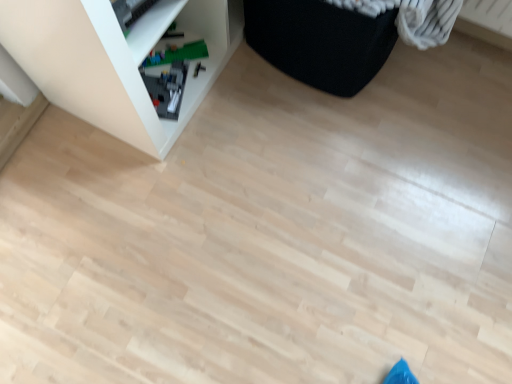
Describe the element at coordinates (177, 54) in the screenshot. I see `green plastic toy at lower left` at that location.

This screenshot has height=384, width=512. What are the coordinates of `white plastic shelf at upper left` in the screenshot? It's located at coord(117,60).

Where is `green plastic toy at lower left`? This screenshot has width=512, height=384. green plastic toy at lower left is located at coordinates pos(177,54).

The width and height of the screenshot is (512, 384). What are the coordinates of `shelf in front of the green plastic toy at lower left` in the screenshot? It's located at (117, 60).

What's the angular difference between green plastic toy at lower left and white plastic shelf at upper left's facing directions?

green plastic toy at lower left and white plastic shelf at upper left are facing 45.8 degrees away from each other.

Visually, is green plastic toy at lower left positioned to the left or to the right of white plastic shelf at upper left?

green plastic toy at lower left is positioned on white plastic shelf at upper left's right side.

From the image's perspective, relative to white plastic shelf at upper left, is green plastic toy at lower left above or below?

From the image's perspective, green plastic toy at lower left appears below white plastic shelf at upper left.

Is white plastic shelf at upper left not close to green plastic toy at lower left?

white plastic shelf at upper left is near green plastic toy at lower left, not far away.

Considering the positions of objects white plastic shelf at upper left and green plastic toy at lower left in the image provided, who is in front, white plastic shelf at upper left or green plastic toy at lower left?

Positioned in front is white plastic shelf at upper left.

The width and height of the screenshot is (512, 384). I want to click on toy behind the white plastic shelf at upper left, so click(177, 54).

Would you say white plastic shelf at upper left is to the left or to the right of green plastic toy at lower left in the picture?

In the image, white plastic shelf at upper left appears on the left side of green plastic toy at lower left.

Is black fabric ottoman at upper right not inside green plastic toy at lower left?

black fabric ottoman at upper right lies outside green plastic toy at lower left's area.

Is black fabric ottoman at upper right placed right next to green plastic toy at lower left?

There is a gap between black fabric ottoman at upper right and green plastic toy at lower left.

From a real-world perspective, between black fabric ottoman at upper right and green plastic toy at lower left, who is vertically lower?

green plastic toy at lower left is physically lower.

Find the location of `furniture above the green plastic toy at lower left (from the image's perspective)`. furniture above the green plastic toy at lower left (from the image's perspective) is located at coordinates (320, 42).

From the image's perspective, is green plastic toy at lower left over black fabric ottoman at upper right?

No, from the image's perspective, green plastic toy at lower left is not above black fabric ottoman at upper right.

Considering the positions of objects green plastic toy at lower left and black fabric ottoman at upper right in the image provided, who is in front, green plastic toy at lower left or black fabric ottoman at upper right?

black fabric ottoman at upper right is in front.

From a real-world perspective, is green plastic toy at lower left physically located above or below black fabric ottoman at upper right?

Clearly, from a real-world perspective, green plastic toy at lower left is below black fabric ottoman at upper right.

Considering the relative sizes of white plastic shelf at upper left and black fabric ottoman at upper right in the image provided, is white plastic shelf at upper left bigger than black fabric ottoman at upper right?

Yes, white plastic shelf at upper left is bigger than black fabric ottoman at upper right.

Can you confirm if white plastic shelf at upper left is positioned to the right of black fabric ottoman at upper right?

No.

Does point (21, 14) come farther from viewer compared to point (248, 5)?

No, (21, 14) is closer to viewer.

Could you tell me if white plastic shelf at upper left is facing black fabric ottoman at upper right?

Yes, white plastic shelf at upper left is aimed at black fabric ottoman at upper right.

How different are the orientations of black fabric ottoman at upper right and white plastic shelf at upper left in degrees?

The facing directions of black fabric ottoman at upper right and white plastic shelf at upper left are 9.16e-06 degrees apart.

From the image's perspective, does black fabric ottoman at upper right appear lower than white plastic shelf at upper left?

No, from the image's perspective, black fabric ottoman at upper right is not beneath white plastic shelf at upper left.

From a real-world perspective, which object rests below the other?

black fabric ottoman at upper right, from a real-world perspective.

This screenshot has width=512, height=384. I want to click on furniture behind the white plastic shelf at upper left, so click(x=320, y=42).

The width and height of the screenshot is (512, 384). In order to click on toy on the right of the white plastic shelf at upper left in this screenshot , I will do `click(177, 54)`.

This screenshot has height=384, width=512. Identify the location of shelf above the green plastic toy at lower left (from the image's perspective). (117, 60).

Estimate the real-world distances between objects in this image. Which object is closer to white plastic shelf at upper left, green plastic toy at lower left or black fabric ottoman at upper right?

green plastic toy at lower left is closer to white plastic shelf at upper left.

Which object lies further to the anchor point black fabric ottoman at upper right, green plastic toy at lower left or white plastic shelf at upper left?

green plastic toy at lower left lies further to black fabric ottoman at upper right than the other object.

When comparing their distances from white plastic shelf at upper left, does black fabric ottoman at upper right or green plastic toy at lower left seem further?

The object further to white plastic shelf at upper left is black fabric ottoman at upper right.

Looking at the image, which one is located further to green plastic toy at lower left, white plastic shelf at upper left or black fabric ottoman at upper right?

Among the two, black fabric ottoman at upper right is located further to green plastic toy at lower left.

Looking at the image, which one is located closer to green plastic toy at lower left, black fabric ottoman at upper right or white plastic shelf at upper left?

white plastic shelf at upper left is positioned closer to the anchor green plastic toy at lower left.

Estimate the real-world distances between objects in this image. Which object is further from black fabric ottoman at upper right, white plastic shelf at upper left or green plastic toy at lower left?

green plastic toy at lower left is further to black fabric ottoman at upper right.

At what (x,y) coordinates should I click in order to perform the action: click on furniture located between white plastic shelf at upper left and green plastic toy at lower left in the depth direction. Please return your answer as a coordinate pair (x, y). This screenshot has width=512, height=384. Looking at the image, I should click on (320, 42).